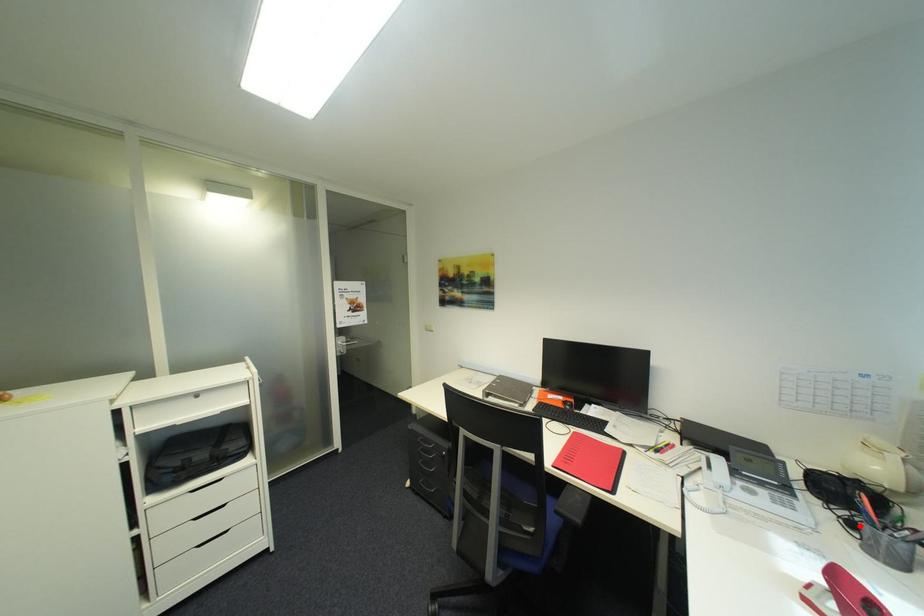
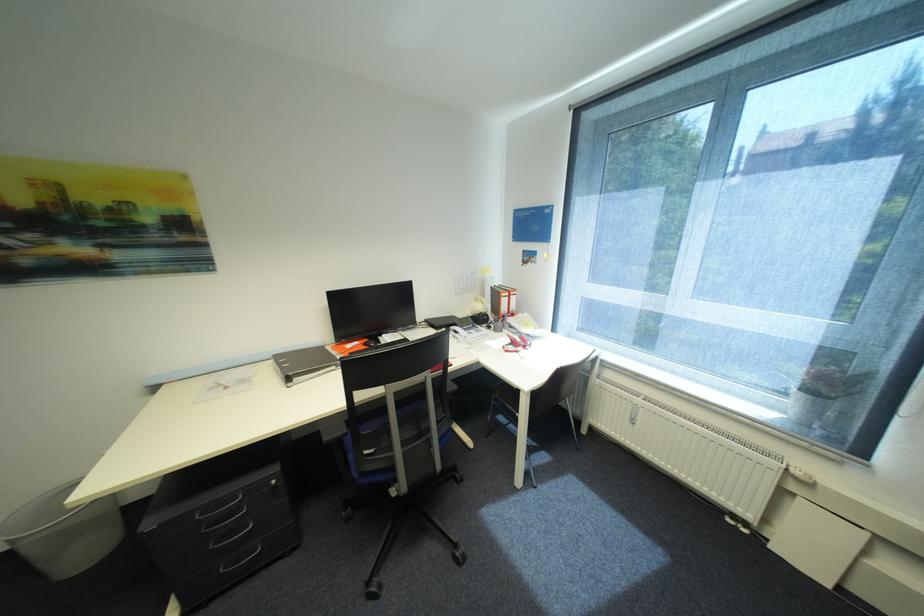
In the second image, find the point that corresponds to the highlighted location in the first image.

(496, 328)